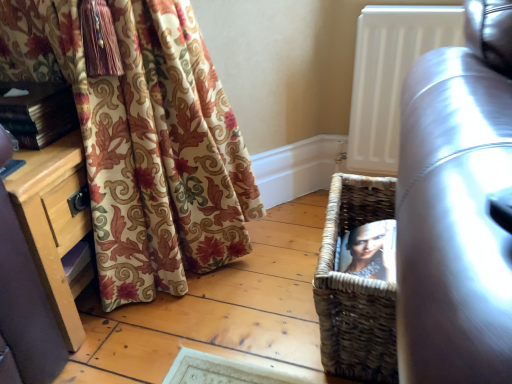
Question: Can you confirm if leather couch at right is bigger than woven brown basket at lower right?

Choices:
 (A) no
 (B) yes

Answer: (B)

Question: Is leather couch at right beside woven brown basket at lower right?

Choices:
 (A) no
 (B) yes

Answer: (A)

Question: Is leather couch at right outside of woven brown basket at lower right?

Choices:
 (A) no
 (B) yes

Answer: (B)

Question: From the image's perspective, does leather couch at right appear lower than woven brown basket at lower right?

Choices:
 (A) yes
 (B) no

Answer: (B)

Question: Is leather couch at right turned away from woven brown basket at lower right?

Choices:
 (A) no
 (B) yes

Answer: (A)

Question: Is leather couch at right oriented towards woven brown basket at lower right?

Choices:
 (A) no
 (B) yes

Answer: (A)

Question: Considering the relative positions of woven brown basket at lower right and leather couch at right in the image provided, is woven brown basket at lower right to the right of leather couch at right from the viewer's perspective?

Choices:
 (A) yes
 (B) no

Answer: (B)

Question: Considering the relative sizes of woven brown basket at lower right and leather couch at right in the image provided, is woven brown basket at lower right bigger than leather couch at right?

Choices:
 (A) no
 (B) yes

Answer: (A)

Question: Does woven brown basket at lower right have a lesser height compared to leather couch at right?

Choices:
 (A) no
 (B) yes

Answer: (B)

Question: From a real-world perspective, is woven brown basket at lower right under leather couch at right?

Choices:
 (A) yes
 (B) no

Answer: (A)

Question: Is woven brown basket at lower right further to camera compared to leather couch at right?

Choices:
 (A) yes
 (B) no

Answer: (A)

Question: Does woven brown basket at lower right have a smaller size compared to leather couch at right?

Choices:
 (A) yes
 (B) no

Answer: (A)

Question: Can you confirm if wooden dresser at lower left is bigger than leather couch at right?

Choices:
 (A) yes
 (B) no

Answer: (B)